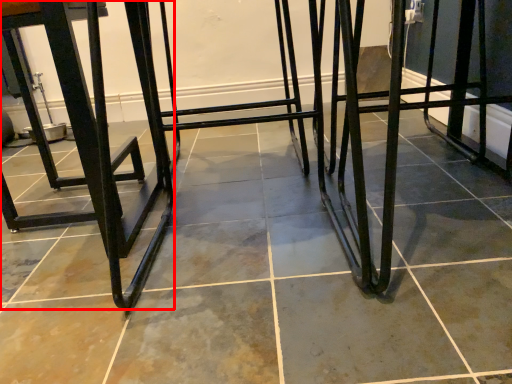
Question: Considering the relative positions of furniture (annotated by the red box) and step stool in the image provided, where is furniture (annotated by the red box) located with respect to the staircase?

Choices:
 (A) left
 (B) right

Answer: (A)